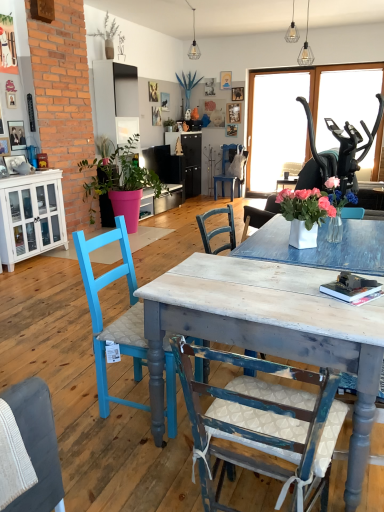
Locate an element on the screen. clear glass pendant light at upper center, the 3th lamp from the front is located at coordinates (194, 44).

At what (x,y) coordinates should I click in order to perform the action: click on blue fabric chair at center, the fourth chair when ordered from bottom to top. Please return your answer as a coordinate pair (x, y). The height and width of the screenshot is (512, 384). Looking at the image, I should click on (225, 170).

I want to click on distressed wood table at center, so click(269, 330).

Where is `wooden picture frame at upper left`? The height and width of the screenshot is (512, 384). wooden picture frame at upper left is located at coordinates coord(4,146).

Describe the element at coordinates (306, 48) in the screenshot. I see `metallic wire cage at upper center, the second lamp when ordered from right to left` at that location.

Find the location of a particular element. clear glass pendant light at upper center, which is counted as the first lamp, starting from the left is located at coordinates (194, 44).

Is green matte plant at upper center, positioned as the 1th houseplant in top-to-bottom order, completely or partially inside woven fabric chair at lower left, which is counted as the second chair, starting from the front?

No, green matte plant at upper center, positioned as the 1th houseplant in top-to-bottom order, is not inside woven fabric chair at lower left, which is counted as the second chair, starting from the front.

From the image's perspective, would you say woven fabric chair at lower left, placed as the 3th chair when sorted from top to bottom, is positioned over green matte plant at upper center, the third houseplant in the bottom-to-top sequence?

Actually, woven fabric chair at lower left, placed as the 3th chair when sorted from top to bottom, appears below green matte plant at upper center, the third houseplant in the bottom-to-top sequence, in the image.

Is woven fabric chair at lower left, marked as the 3th chair in a back-to-front arrangement, directly adjacent to green matte plant at upper center, which ranks as the second houseplant in back-to-front order?

No.

Are metallic wire cage at upper center, which is the third lamp from left to right, and blue fabric chair at center, placed as the 4th chair when sorted from front to back, located far from each other?

That's right, there is a large distance between metallic wire cage at upper center, which is the third lamp from left to right, and blue fabric chair at center, placed as the 4th chair when sorted from front to back.

Between metallic wire cage at upper center, the second lamp when ordered from back to front, and blue fabric chair at center, the 1th chair viewed from the back, which one has smaller width?

metallic wire cage at upper center, the second lamp when ordered from back to front.

Consider the image. Is metallic wire cage at upper center, which is the third lamp from left to right, to the left or to the right of blue fabric chair at center, which is the first chair from top to bottom, in the image?

From the image, it's evident that metallic wire cage at upper center, which is the third lamp from left to right, is to the right of blue fabric chair at center, which is the first chair from top to bottom.

Considering the relative sizes of distressed wood chair at center, marked as the 4th chair in a top-to-bottom arrangement, and white glass cabinet at left in the image provided, is distressed wood chair at center, marked as the 4th chair in a top-to-bottom arrangement, shorter than white glass cabinet at left?

Yes.

Identify the location of cabinetry above the distressed wood chair at center, which is counted as the 1th chair, starting from the bottom (from the image's perspective). This screenshot has height=512, width=384. (31, 216).

Is distressed wood chair at center, acting as the first chair starting from the front, further to the viewer compared to white glass cabinet at left?

No, distressed wood chair at center, acting as the first chair starting from the front, is in front of white glass cabinet at left.

Is point (206, 439) closer to viewer compared to point (21, 196)?

Yes.

Which object is more forward, green matte plant at upper center, the second houseplant from the bottom, or blue painted wood chair at left, the third chair positioned from the front?

blue painted wood chair at left, the third chair positioned from the front, is closer to the camera.

Does green matte plant at upper center, placed as the 2th houseplant when sorted from top to bottom, have a greater height compared to blue painted wood chair at left, placed as the 2th chair when sorted from top to bottom?

No, green matte plant at upper center, placed as the 2th houseplant when sorted from top to bottom, is not taller than blue painted wood chair at left, placed as the 2th chair when sorted from top to bottom.

Does green matte plant at upper center, arranged as the third houseplant when viewed from the front, have a greater width compared to blue painted wood chair at left, the third chair positioned from the front?

In fact, green matte plant at upper center, arranged as the third houseplant when viewed from the front, might be narrower than blue painted wood chair at left, the third chair positioned from the front.

From a real-world perspective, is green matte plant at upper center, which appears as the 1th houseplant when viewed from the back, below blue painted wood chair at left, placed as the 2th chair when sorted from top to bottom?

No, from a real-world perspective, green matte plant at upper center, which appears as the 1th houseplant when viewed from the back, is not below blue painted wood chair at left, placed as the 2th chair when sorted from top to bottom.

Does point (308, 24) appear closer or farther from the camera than point (292, 27)?

Clearly, point (308, 24) is closer to the camera than point (292, 27).

From the image's perspective, would you say metallic wire cage at upper center, positioned as the third lamp in back-to-front order, is shown under metallic wire cage at upper center, the 2th lamp in the front-to-back sequence?

Yes, from the image's perspective, metallic wire cage at upper center, positioned as the third lamp in back-to-front order, is below metallic wire cage at upper center, the 2th lamp in the front-to-back sequence.

Is metallic wire cage at upper center, the second lamp when ordered from right to left, not within metallic wire cage at upper center, which is the third lamp from left to right?

Absolutely, metallic wire cage at upper center, the second lamp when ordered from right to left, is external to metallic wire cage at upper center, which is the third lamp from left to right.

How many degrees apart are the facing directions of metallic wire cage at upper center, the first lamp positioned from the front, and metallic wire cage at upper center, the 2th lamp in the front-to-back sequence?

metallic wire cage at upper center, the first lamp positioned from the front, and metallic wire cage at upper center, the 2th lamp in the front-to-back sequence, are facing 90 degrees away from each other.

Is blue fabric chair at center, placed as the 4th chair when sorted from front to back, aimed at wooden picture frame at upper left?

Yes, blue fabric chair at center, placed as the 4th chair when sorted from front to back, is turned towards wooden picture frame at upper left.

Which object is positioned more to the left, blue fabric chair at center, placed as the 4th chair when sorted from front to back, or wooden picture frame at upper left?

wooden picture frame at upper left is more to the left.

Does blue fabric chair at center, the fourth chair when ordered from bottom to top, have a lesser height compared to wooden picture frame at upper left?

No, blue fabric chair at center, the fourth chair when ordered from bottom to top, is not shorter than wooden picture frame at upper left.

Is blue fabric chair at center, the fourth chair when ordered from bottom to top, positioned beyond the bounds of wooden picture frame at upper left?

blue fabric chair at center, the fourth chair when ordered from bottom to top, lies outside wooden picture frame at upper left's area.

Where is `the 1st houseplant behind when counting from the matte pink pot at left, marked as the first houseplant in a front-to-back arrangement`? The width and height of the screenshot is (384, 512). the 1st houseplant behind when counting from the matte pink pot at left, marked as the first houseplant in a front-to-back arrangement is located at coordinates [x=107, y=36].

Looking at this image, is green matte plant at upper center, which ranks as the second houseplant in back-to-front order, looking in the opposite direction of matte pink pot at left, the 3th houseplant in the top-to-bottom sequence?

No, green matte plant at upper center, which ranks as the second houseplant in back-to-front order,'s orientation is not away from matte pink pot at left, the 3th houseplant in the top-to-bottom sequence.

Looking at their sizes, would you say green matte plant at upper center, positioned as the second houseplant in front-to-back order, is wider or thinner than matte pink pot at left, which ranks as the third houseplant in back-to-front order?

green matte plant at upper center, positioned as the second houseplant in front-to-back order, is thinner than matte pink pot at left, which ranks as the third houseplant in back-to-front order.

At what (x,y) coordinates should I click in order to perform the action: click on chair that is the 1st one below the green matte plant at upper center, the third houseplant in the bottom-to-top sequence (from a real-world perspective). Please return your answer as a coordinate pair (x, y). Image resolution: width=384 pixels, height=512 pixels. Looking at the image, I should click on (29, 450).

At what (x,y) coordinates should I click in order to perform the action: click on chair behind the metallic wire cage at upper center, which is counted as the 1th lamp, starting from the right. Please return your answer as a coordinate pair (x, y). The height and width of the screenshot is (512, 384). Looking at the image, I should click on (225, 170).

Looking at this image, which object lies nearer to the anchor point green matte plant at upper center, arranged as the third houseplant when viewed from the front, distressed wood table at center or metallic wire cage at upper center, the second lamp when ordered from back to front?

metallic wire cage at upper center, the second lamp when ordered from back to front, is closer to green matte plant at upper center, arranged as the third houseplant when viewed from the front.

Based on their spatial positions, is blue painted wood chair at left, the third chair positioned from the front, or distressed wood table at center closer to metallic wire cage at upper center, positioned as the third lamp in back-to-front order?

Among the two, blue painted wood chair at left, the third chair positioned from the front, is located nearer to metallic wire cage at upper center, positioned as the third lamp in back-to-front order.

From the image, which object appears to be nearer to matte pink pot at left, the 1th houseplant in the bottom-to-top sequence, blue painted wood chair at left, placed as the 2th chair when sorted from top to bottom, or white glass cabinet at left?

white glass cabinet at left lies closer to matte pink pot at left, the 1th houseplant in the bottom-to-top sequence, than the other object.

From the image, which object appears to be farther from blue painted wood chair at left, placed as the 2th chair when sorted from top to bottom, metallic wire cage at upper center, the second lamp when ordered from back to front, or green matte plant at upper center, arranged as the third houseplant when viewed from the front?

green matte plant at upper center, arranged as the third houseplant when viewed from the front, is positioned further to the anchor blue painted wood chair at left, placed as the 2th chair when sorted from top to bottom.

Estimate the real-world distances between objects in this image. Which object is closer to green matte plant at upper center, the third houseplant in the bottom-to-top sequence, blue fabric chair at center, which is the first chair from top to bottom, or metallic wire cage at upper center, the first lamp positioned from the front?

blue fabric chair at center, which is the first chair from top to bottom.

Which object lies further to the anchor point clear glass pendant light at upper center, placed as the first lamp when sorted from back to front, green matte plant at upper center, arranged as the third houseplant when viewed from the front, or transparent glass door at upper center?

transparent glass door at upper center lies further to clear glass pendant light at upper center, placed as the first lamp when sorted from back to front, than the other object.

Based on the photo, based on their spatial positions, is distressed wood table at center or transparent glass door at upper center closer to clear glass pendant light at upper center, placed as the first lamp when sorted from back to front?

transparent glass door at upper center is closer to clear glass pendant light at upper center, placed as the first lamp when sorted from back to front.

Considering their positions, is matte pink pot at left, which ranks as the third houseplant in back-to-front order, positioned closer to distressed wood chair at center, which is counted as the 1th chair, starting from the bottom, than wooden picture frame at upper left?

Based on the image, wooden picture frame at upper left appears to be nearer to distressed wood chair at center, which is counted as the 1th chair, starting from the bottom.

This screenshot has height=512, width=384. I want to click on picture frame between distressed wood table at center and matte pink pot at left, which ranks as the third houseplant in back-to-front order, along the z-axis, so click(x=4, y=146).

The image size is (384, 512). I want to click on coffee table between woven fabric chair at lower left, marked as the 3th chair in a back-to-front arrangement, and wooden picture frame at upper left, along the z-axis, so click(x=269, y=330).

Find the location of `picture frame between black plastic exercise machine at upper right and transparent glass door at upper center from front to back`. picture frame between black plastic exercise machine at upper right and transparent glass door at upper center from front to back is located at coordinates (4, 146).

Image resolution: width=384 pixels, height=512 pixels. Identify the location of coffee table between distressed wood chair at center, marked as the 4th chair in a top-to-bottom arrangement, and green matte plant at upper center, which appears as the 1th houseplant when viewed from the back, in the front-back direction. (269, 330).